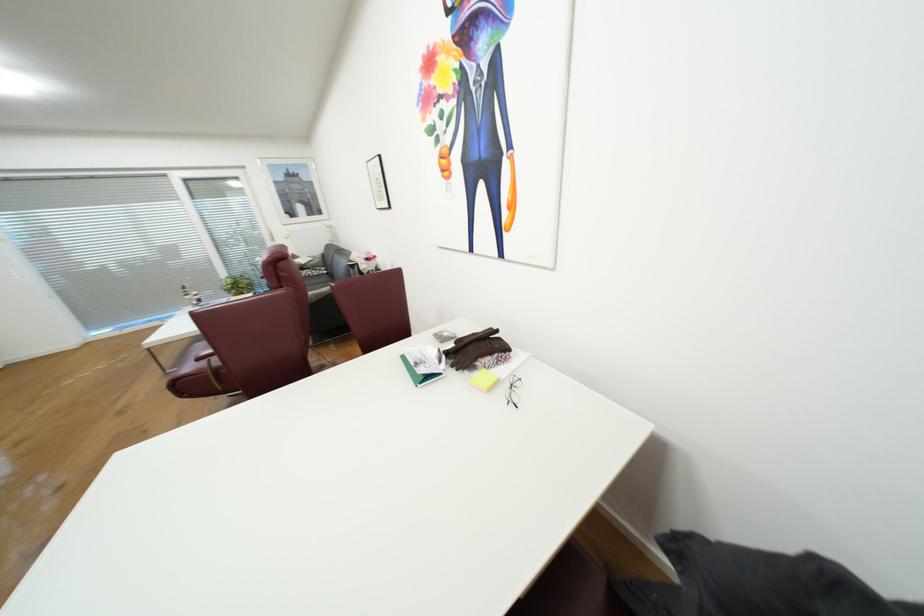
Where is `stack of sticky notes`? stack of sticky notes is located at coordinates (483, 379).